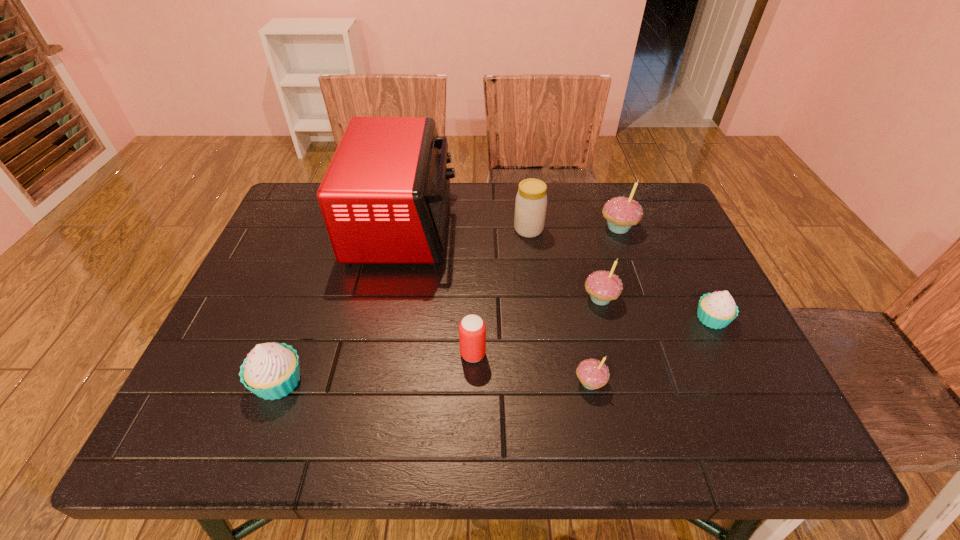
Find the location of a particular element. Image resolution: width=960 pixels, height=540 pixels. toaster oven is located at coordinates (384, 198).

The width and height of the screenshot is (960, 540). What are the coordinates of `the tallest object` in the screenshot? It's located at (384, 198).

In order to click on the second cupcake from right to left in this screenshot , I will do 621,213.

This screenshot has height=540, width=960. Identify the location of the tallest cupcake. (621, 213).

Find the location of `jar`. jar is located at coordinates coord(531,200).

The image size is (960, 540). Find the location of `the second farthest pink cupcake`. the second farthest pink cupcake is located at coordinates (603, 286).

At what (x,y) coordinates should I click in order to perform the action: click on the nearer white cupcake. Please return your answer as a coordinate pair (x, y). Looking at the image, I should click on (271, 371).

Find the location of `the bigger white cupcake`. the bigger white cupcake is located at coordinates (271, 371).

Locate an element on the screen. The width and height of the screenshot is (960, 540). beer can is located at coordinates (472, 329).

The image size is (960, 540). Find the location of `red beer can`. red beer can is located at coordinates (472, 329).